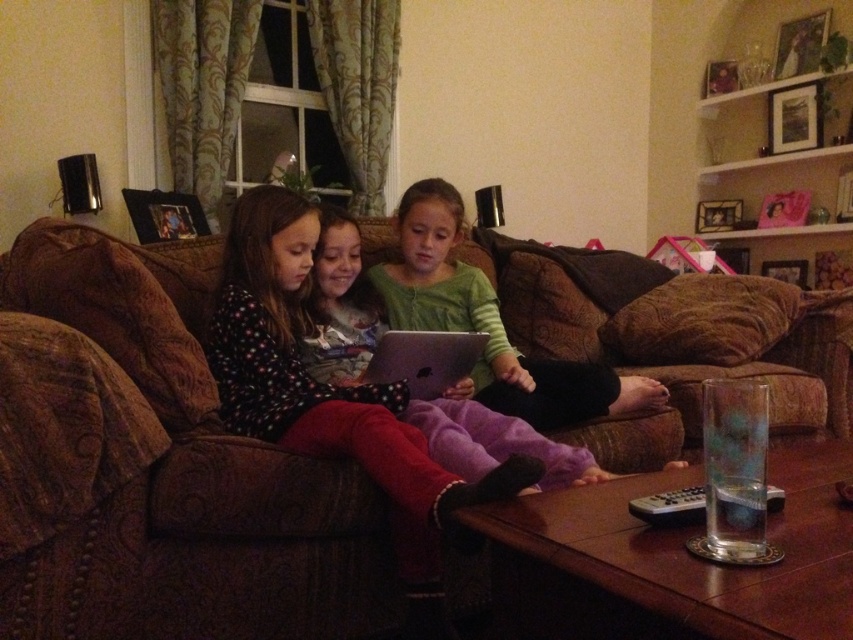
Does point (367, 616) come closer to viewer compared to point (596, 396)?

Yes, it is in front of point (596, 396).

Based on the photo, is brown fabric couch at center thinner than green soft shirt at center?

No, brown fabric couch at center is not thinner than green soft shirt at center.

Image resolution: width=853 pixels, height=640 pixels. Find the location of `brown fabric couch at center`. brown fabric couch at center is located at coordinates (207, 458).

Identify the location of brown fabric couch at center. (207, 458).

Does polka dot fleece at center appear on the right side of silver metallic laptop at center?

No, polka dot fleece at center is not to the right of silver metallic laptop at center.

Identify the location of polka dot fleece at center. This screenshot has width=853, height=640. (334, 397).

Which is more to the right, brown fabric couch at center or polka dot fleece at center?

brown fabric couch at center is more to the right.

Is point (44, 280) farther from viewer compared to point (236, 339)?

No, it is in front of (236, 339).

Image resolution: width=853 pixels, height=640 pixels. Identify the location of brown fabric couch at center. (207, 458).